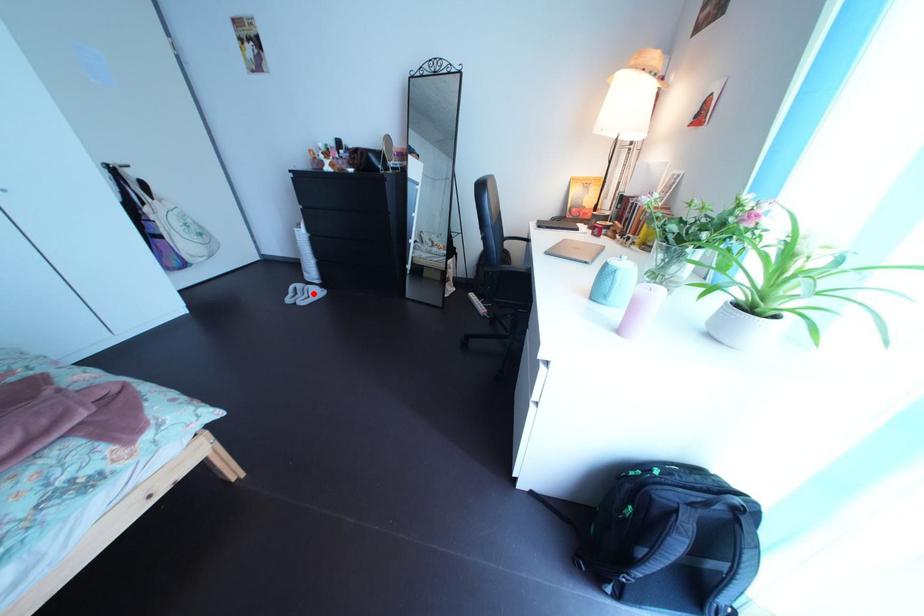
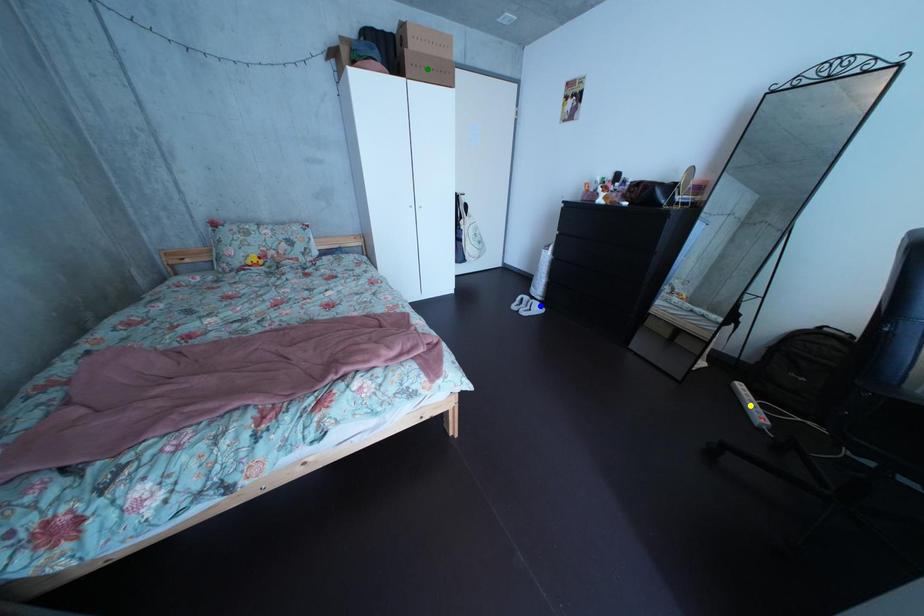
Question: I am providing you with two images of the same scene from different viewpoints. A red point is marked on the first image. You are given multiple points on the second image. Which point in image 2 represents the same 3d spot as the red point in image 1?

Choices:
 (A) blue point
 (B) green point
 (C) yellow point

Answer: (A)